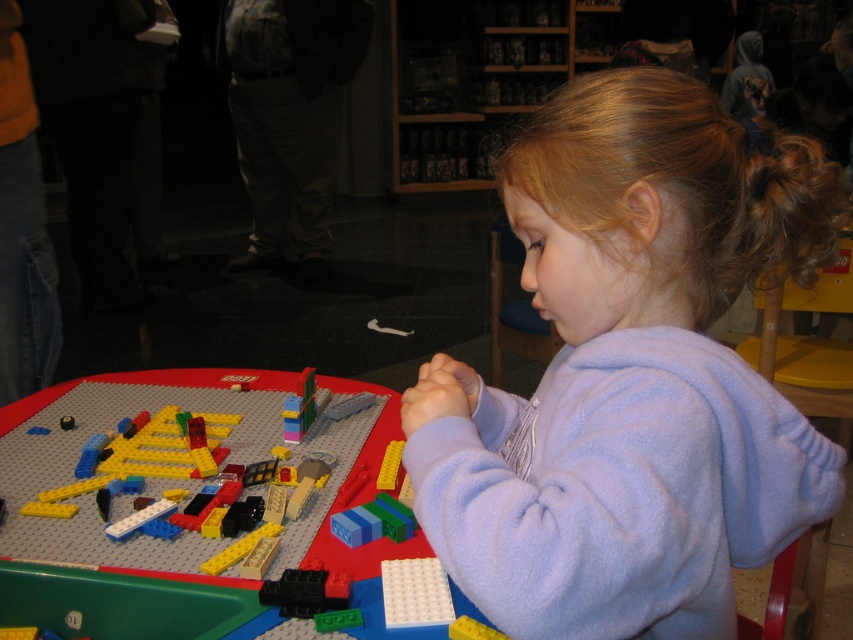
You are a parent trying to organize the LEGO pieces. You have a white plastic plate at lower center and a yellow matte brick at center. Which object should you place first if you want to use the larger item as the base?

The white plastic plate at lower center is bigger than the yellow matte brick at center, so you should place the white plastic plate at lower center first as the base.

You are helping the girl organize her LEGO pieces. She wants to place both the purple fleece at center and the yellow matte brick at center side by side on the table. Which object should she place first to ensure they both fit without overlapping?

The purple fleece at center has a larger width than the yellow matte brick at center, so she should place the purple fleece at center first to accommodate its greater width before placing the yellow matte brick at center next.